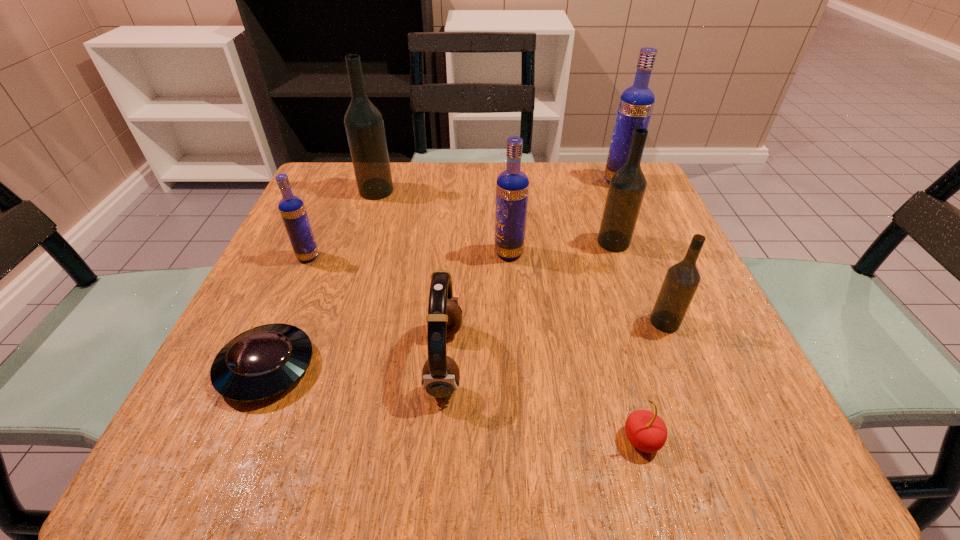
The height and width of the screenshot is (540, 960). I want to click on empty space between the second farthest black vodka and the biggest black vodka, so click(494, 217).

I want to click on vacant space that's between the headset and the eighth tallest object, so click(543, 400).

Locate an element on the screen. vacant area that lies between the rightmost blue vodka and the leftmost blue vodka is located at coordinates coord(463,219).

Locate an element on the screen. Image resolution: width=960 pixels, height=540 pixels. free spot between the second nearest black vodka and the leftmost vodka is located at coordinates (461, 249).

Identify the location of free space between the smallest black vodka and the cherry. (653, 381).

Identify which object is the closest to the sixth object from right to left. Please provide its 2D coordinates. Your answer should be formatted as a tuple, i.e. [(x, y)], where the tuple contains the x and y coordinates of a point satisfying the conditions above.

[(512, 186)]

Locate an element on the screen. Image resolution: width=960 pixels, height=540 pixels. object that stands as the fifth closest to the third vodka from left to right is located at coordinates (636, 103).

Point out which vodka is positioned as the third nearest to the fifth object from left to right. Please provide its 2D coordinates. Your answer should be formatted as a tuple, i.e. [(x, y)], where the tuple contains the x and y coordinates of a point satisfying the conditions above.

[(364, 125)]

I want to click on vodka object that ranks as the second closest to the second nearest black vodka, so click(x=681, y=281).

At what (x,y) coordinates should I click in order to perform the action: click on the closest blue vodka to the leftmost vodka. Please return your answer as a coordinate pair (x, y). Looking at the image, I should click on (512, 186).